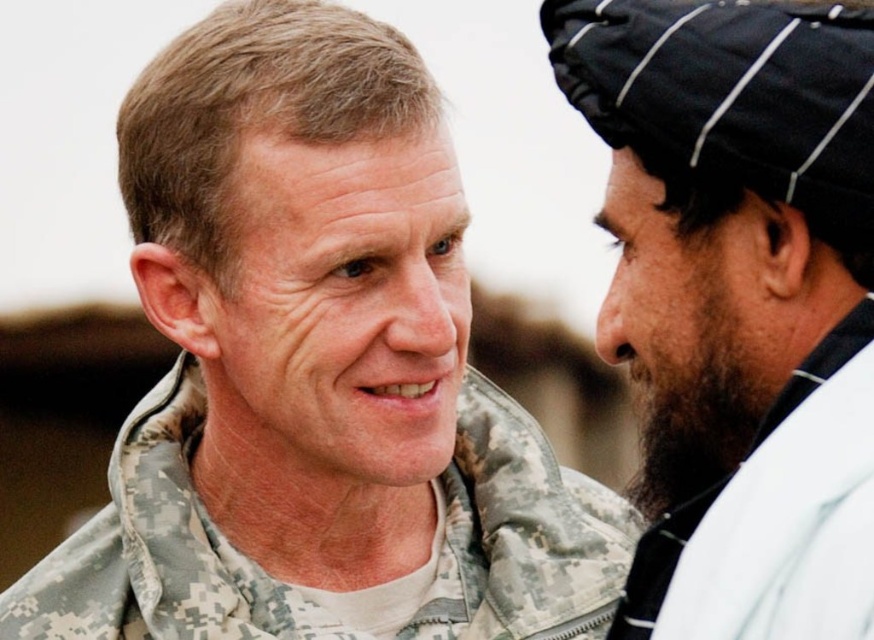
You are a photographer trying to capture a clear shot of both the black woven turban at right and the camouflage fabric jacket at center. Since you can only focus on one object at a time, which one should you choose to ensure the other remains in the background?

You should focus on the black woven turban at right because it is closer to the viewer than the camouflage fabric jacket at center, so the jacket will naturally be in the background when the turban is in focus.

You are designing a poster and need to place the camouflage jacket at center and the black fabric beard at right on it. Since the poster has limited space, you want to know which object takes up more horizontal space. Which one is wider?

The camouflage jacket at center is wider than the black fabric beard at right because the camouflage jacket at center has a larger width.